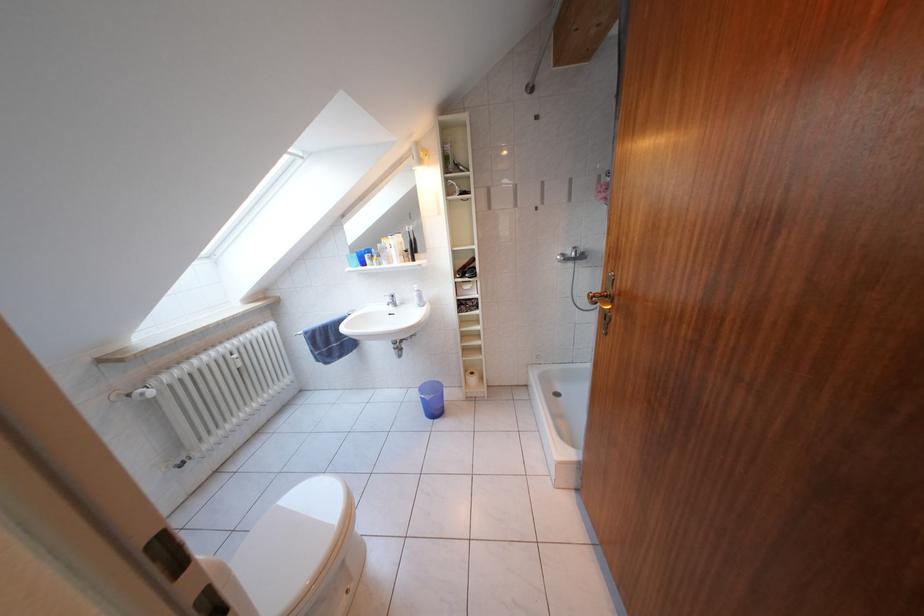
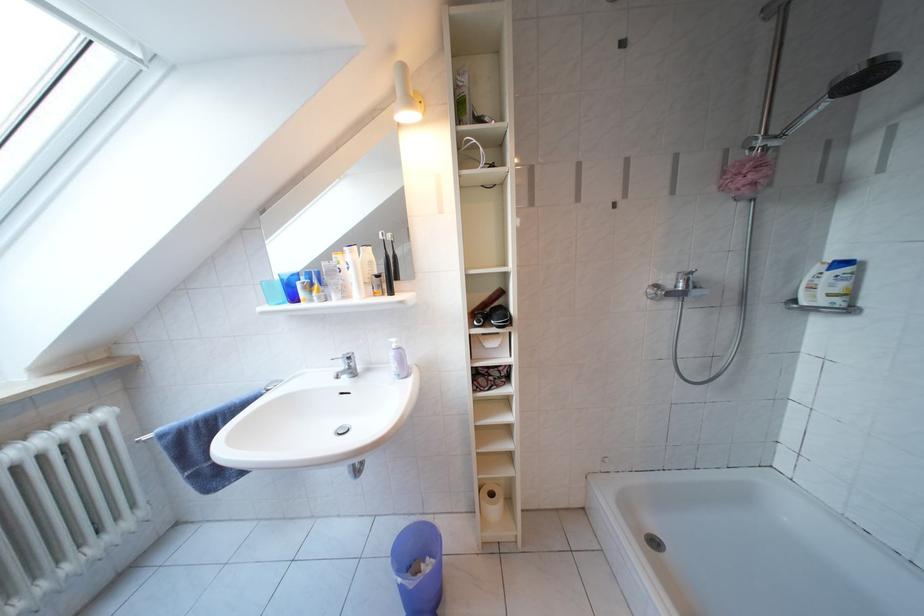
Where in the second image is the point corresponding to point (280, 330) from the first image?

(110, 421)